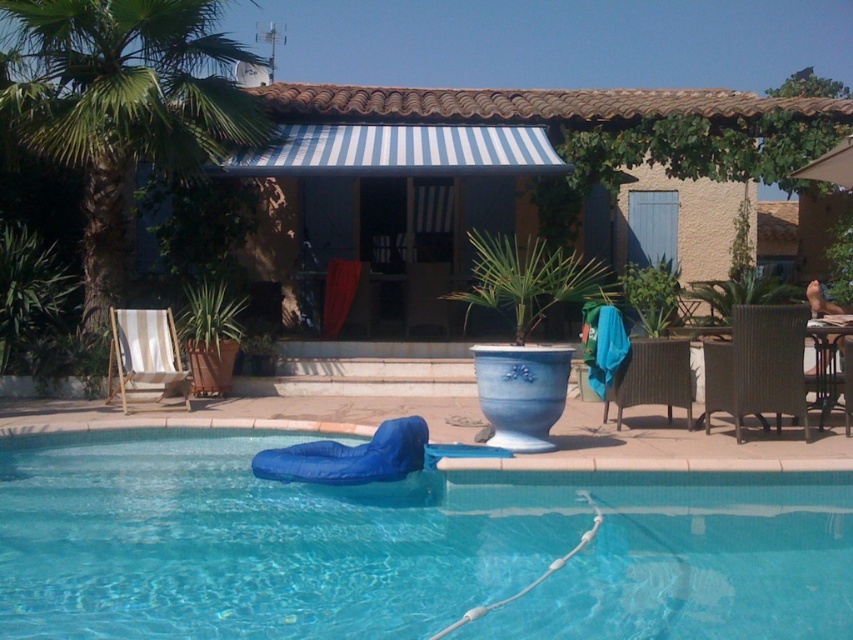
You are a GUI agent. You are given a task and a screenshot of the screen. Output one action in this format:
    pyautogui.click(x=<x>, y=<y>)
    Task: Click on the blue fabric at lower center
    This screenshot has height=640, width=853.
    Given the screenshot: What is the action you would take?
    pyautogui.click(x=405, y=547)

Does blue fabric at lower center come in front of brown wicker chair at lower right?

Yes, it is in front of brown wicker chair at lower right.

Measure the distance between point (x=396, y=486) and camera.

Point (x=396, y=486) and camera are 22.03 feet apart from each other.

Find the location of a particular element. blue fabric at lower center is located at coordinates (405, 547).

Is the position of green leafy palm tree at left more distant than that of beige striped beach chair at left?

Yes, it is.

Is point (36, 109) more distant than point (186, 371)?

No, (36, 109) is closer to viewer.

Which is in front, point (137, 74) or point (114, 394)?

Positioned in front is point (137, 74).

Find the location of a particular element. green leafy palm tree at left is located at coordinates (122, 106).

Between blue fabric at lower center and beige striped beach chair at left, which one appears on the left side from the viewer's perspective?

beige striped beach chair at left is more to the left.

Describe the element at coordinates (405, 547) in the screenshot. The image size is (853, 640). I see `blue fabric at lower center` at that location.

Image resolution: width=853 pixels, height=640 pixels. What are the coordinates of `blue fabric at lower center` in the screenshot? It's located at (405, 547).